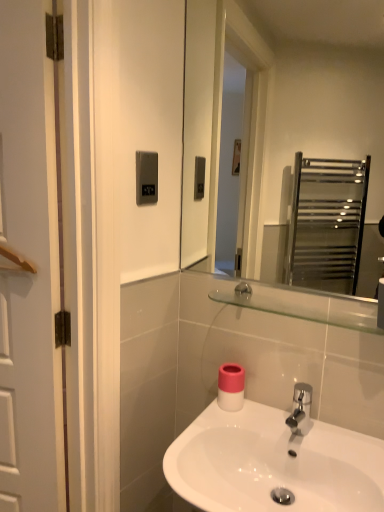
Question: Would you say clear glass mirror at upper center is to the left or to the right of clear glass shelf at upper center in the picture?

Choices:
 (A) right
 (B) left

Answer: (B)

Question: Is clear glass mirror at upper center wider or thinner than clear glass shelf at upper center?

Choices:
 (A) thin
 (B) wide

Answer: (A)

Question: Based on their relative distances, which object is nearer to the white glossy sink at center?

Choices:
 (A) satin silver panel at upper center
 (B) clear glass mirror at upper center
 (C) pink matte toilet paper at center
 (D) clear glass shelf at upper center

Answer: (C)

Question: Based on their relative distances, which object is farther from the satin silver panel at upper center?

Choices:
 (A) white glossy sink at center
 (B) pink matte toilet paper at center
 (C) clear glass shelf at upper center
 (D) clear glass mirror at upper center

Answer: (D)